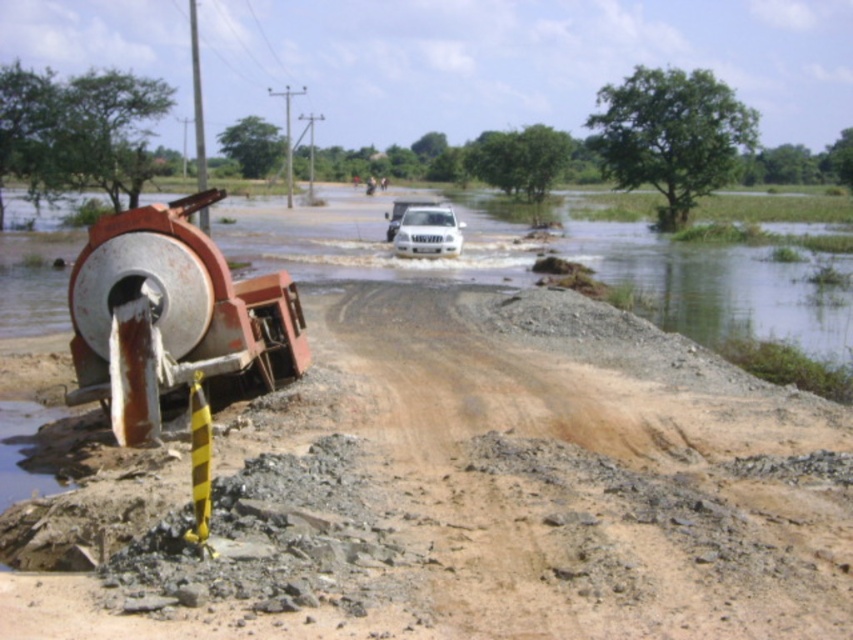
You are a driver approaching the flooded road. You see the brown gravel dirt track at center and the white matte suv at center. Which object is positioned to the left of the SUV?

The brown gravel dirt track at center is to the left of the white matte suv at center.

You are a driver approaching the flooded road. You see the brown gravel dirt track at center and the white matte suv at center. Which object is closer to you as you drive towards the flooded area?

The brown gravel dirt track at center is in front of the white matte suv at center, so it is closer to you as you drive towards the flooded area.